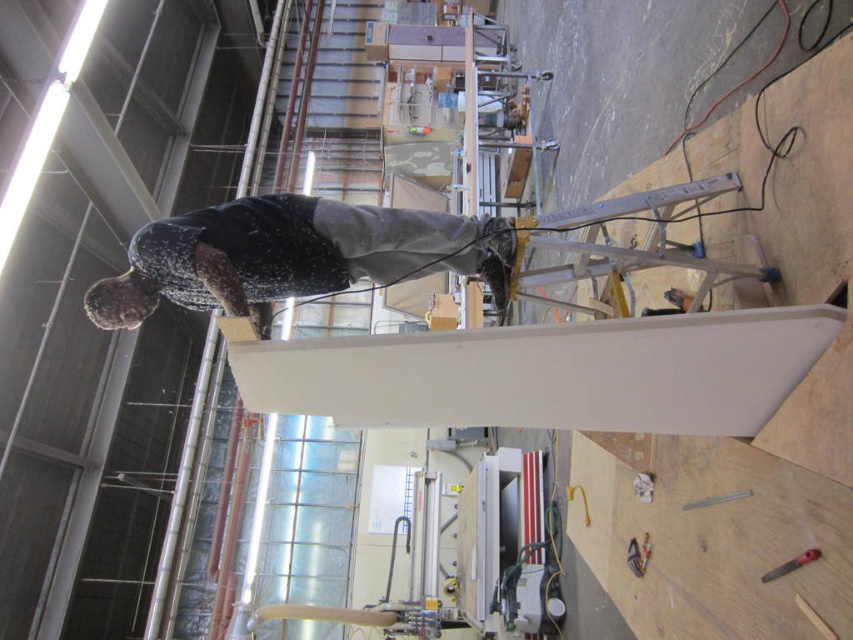
Question: Is white matte beam at center to the right of metallic plastic knife at lower right from the viewer's perspective?

Choices:
 (A) no
 (B) yes

Answer: (A)

Question: Which of the following is the closest to the observer?

Choices:
 (A) (767, 572)
 (B) (593, 346)
 (C) (204, 216)

Answer: (B)

Question: Can you confirm if white matte beam at center is smaller than dark gray fabric skateboarder at center?

Choices:
 (A) yes
 (B) no

Answer: (B)

Question: Can you confirm if white matte beam at center is positioned to the right of dark gray fabric skateboarder at center?

Choices:
 (A) yes
 (B) no

Answer: (A)

Question: Which object is closer to the camera taking this photo?

Choices:
 (A) metallic plastic knife at lower right
 (B) white matte beam at center
 (C) dark gray fabric skateboarder at center

Answer: (C)

Question: Which of the following is the closest to the observer?

Choices:
 (A) (323, 241)
 (B) (390, 397)

Answer: (B)